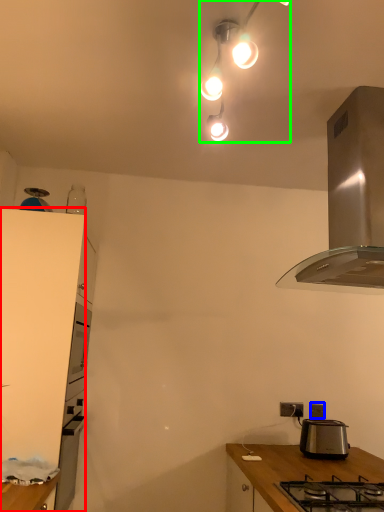
Question: Estimate the real-world distances between objects in this image. Which object is closer to cabinetry (highlighted by a red box), power outlet (highlighted by a blue box) or lamp (highlighted by a green box)?

Choices:
 (A) power outlet
 (B) lamp

Answer: (B)